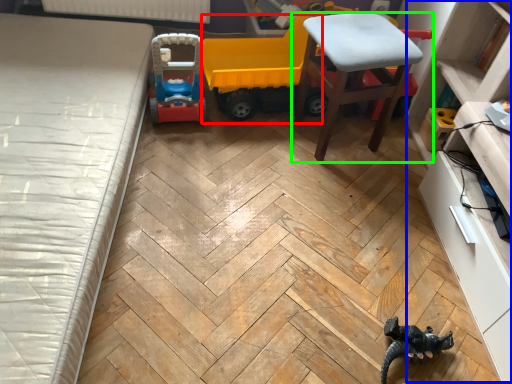
Question: Which object is positioned farthest from model car (highlighted by a red box)? Select from dresser (highlighted by a blue box) and chair (highlighted by a green box).

Choices:
 (A) dresser
 (B) chair

Answer: (A)